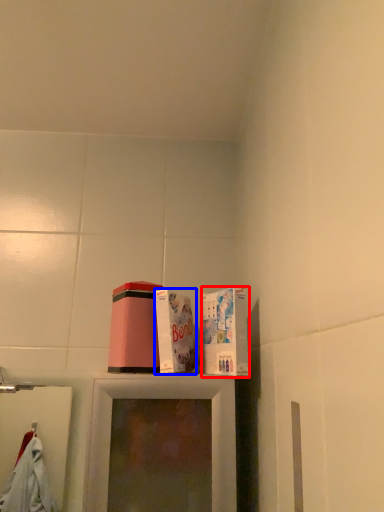
Question: Which object appears farthest to the camera in this image, box (highlighted by a red box) or box (highlighted by a blue box)?

Choices:
 (A) box
 (B) box

Answer: (B)